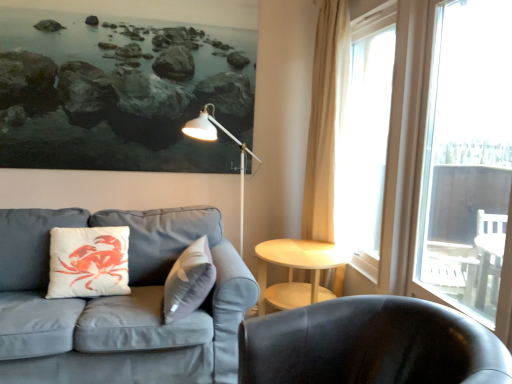
Question: From the image's perspective, is transparent glass window at right, the first window positioned from the front, under translucent glass window at right, positioned as the first window in back-to-front order?

Choices:
 (A) no
 (B) yes

Answer: (B)

Question: Is transparent glass window at right, the second window in the back-to-front sequence, not within translucent glass window at right, which is the 2th window from front to back?

Choices:
 (A) yes
 (B) no

Answer: (A)

Question: From the image's perspective, would you say transparent glass window at right, the second window in the back-to-front sequence, is positioned over translucent glass window at right, positioned as the first window in back-to-front order?

Choices:
 (A) no
 (B) yes

Answer: (A)

Question: Is transparent glass window at right, the first window positioned from the front, in front of translucent glass window at right, positioned as the first window in back-to-front order?

Choices:
 (A) no
 (B) yes

Answer: (B)

Question: Is transparent glass window at right, the second window in the back-to-front sequence, not near translucent glass window at right, positioned as the first window in back-to-front order?

Choices:
 (A) yes
 (B) no

Answer: (B)

Question: In terms of width, does shiny black chair at lower right look wider or thinner when compared to transparent glass window at right, the first window positioned from the front?

Choices:
 (A) thin
 (B) wide

Answer: (B)

Question: From the image's perspective, is shiny black chair at lower right above or below transparent glass window at right, the second window in the back-to-front sequence?

Choices:
 (A) above
 (B) below

Answer: (B)

Question: Considering the relative positions of shiny black chair at lower right and transparent glass window at right, the first window positioned from the front, in the image provided, is shiny black chair at lower right to the left or to the right of transparent glass window at right, the first window positioned from the front,?

Choices:
 (A) left
 (B) right

Answer: (A)

Question: From a real-world perspective, is shiny black chair at lower right positioned above or below transparent glass window at right, the second window in the back-to-front sequence?

Choices:
 (A) above
 (B) below

Answer: (B)

Question: Considering the relative positions of light wood/woodenobject at center and shiny black chair at lower right in the image provided, is light wood/woodenobject at center to the left or to the right of shiny black chair at lower right?

Choices:
 (A) left
 (B) right

Answer: (A)

Question: Based on their sizes in the image, would you say light wood/woodenobject at center is bigger or smaller than shiny black chair at lower right?

Choices:
 (A) big
 (B) small

Answer: (B)

Question: In terms of height, does light wood/woodenobject at center look taller or shorter compared to shiny black chair at lower right?

Choices:
 (A) short
 (B) tall

Answer: (A)

Question: Is light wood/woodenobject at center inside or outside of shiny black chair at lower right?

Choices:
 (A) inside
 (B) outside

Answer: (B)

Question: In the image, is beige fabric curtain at right on the left side or the right side of shiny black chair at lower right?

Choices:
 (A) left
 (B) right

Answer: (B)

Question: From a real-world perspective, is beige fabric curtain at right positioned above or below shiny black chair at lower right?

Choices:
 (A) above
 (B) below

Answer: (A)